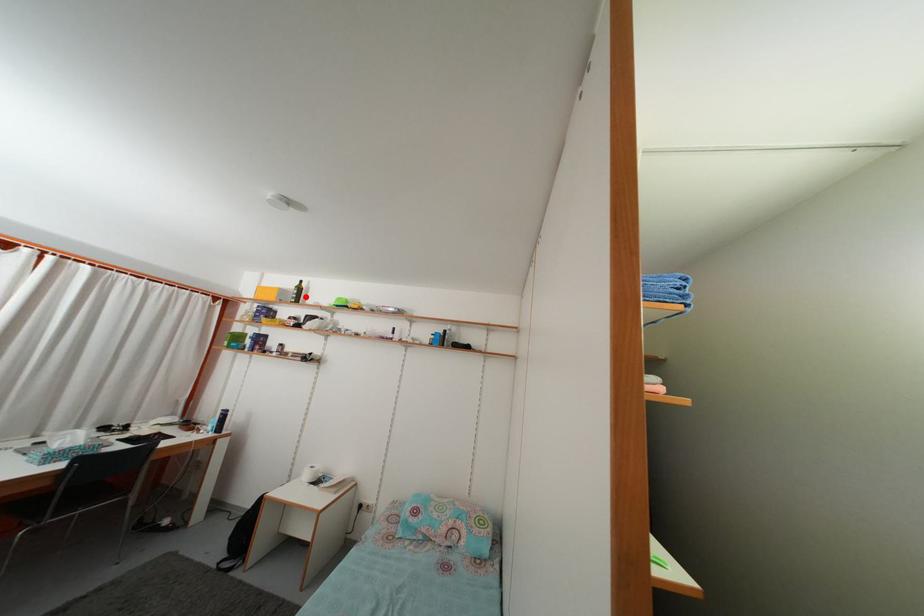
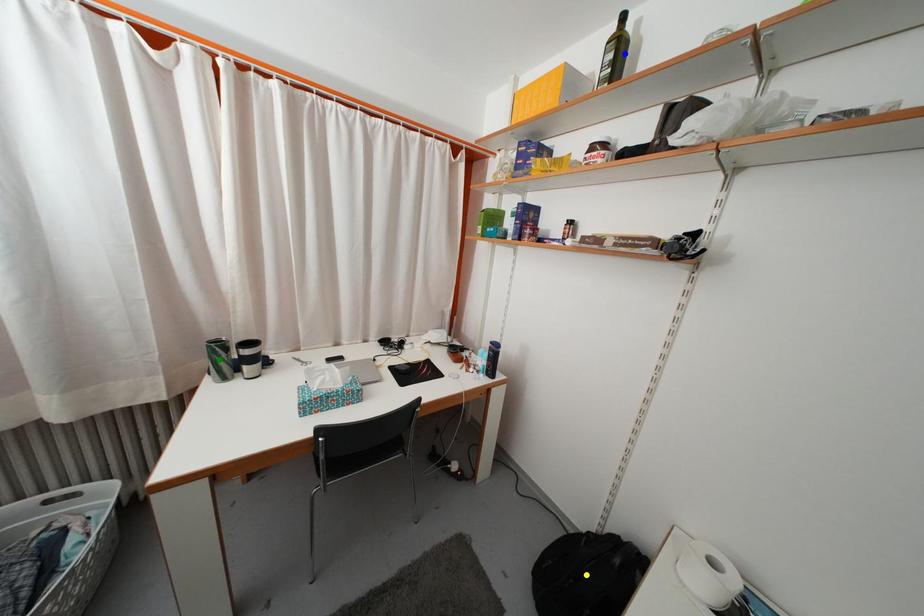
Question: I am providing you with two images of the same scene from different viewpoints. A red point is marked on the first image. You are given multiple points on the second image. Which point in image 2 represents the same 3d spot as the red point in image 1?

Choices:
 (A) blue point
 (B) green point
 (C) yellow point

Answer: (A)